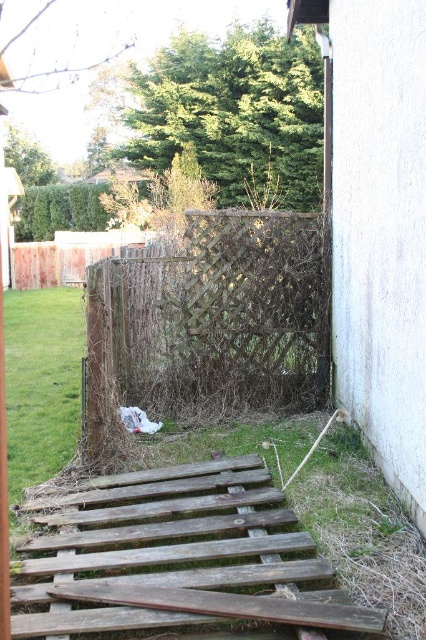
You are a gardener trying to determine the best way to mow the green grass at lower left without damaging the brown woven fence at center. Based on their heights, what should you consider?

The brown woven fence at center is taller than the green grass at lower left, so you should ensure the mower stays clear of the fence to avoid hitting it while mowing the grass.

In the scene shown: You need to place a 1.5 meter wide garden bench between the brown woven fence at center and the green grass at lower left. Based on their widths, will the bench fit in either of these areas?

The brown woven fence at center is narrower than the green grass at lower left. Since the bench is 1.5 meters wide, it may fit in the green grass at lower left if its width is at least 1.5 meters, but it won not fit in the brown woven fence at center due to its smaller width.

Where is the brown woven fence at center located in the image?

The brown woven fence at center is located at point (x=219, y=312).